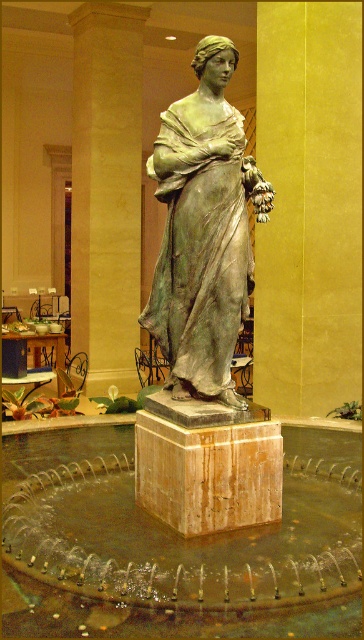
Question: Among these points, which one is farthest from the camera?

Choices:
 (A) (210, 164)
 (B) (89, 115)

Answer: (B)

Question: Does green patina statue at center appear under green marble pillar at center?

Choices:
 (A) no
 (B) yes

Answer: (B)

Question: Does green patina statue at center appear under green marble pillar at center?

Choices:
 (A) yes
 (B) no

Answer: (A)

Question: Among these points, which one is nearest to the camera?

Choices:
 (A) (92, 317)
 (B) (191, 275)

Answer: (B)

Question: Does green patina statue at center appear under green marble pillar at center?

Choices:
 (A) no
 (B) yes

Answer: (B)

Question: Which object appears closest to the camera in this image?

Choices:
 (A) green patina statue at center
 (B) green marble pillar at center

Answer: (A)